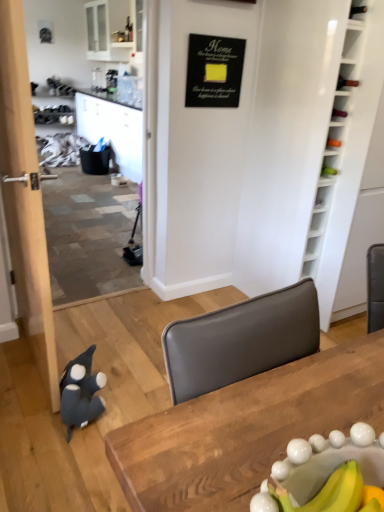
Question: Does point (112, 454) appear closer or farther from the camera than point (61, 413)?

Choices:
 (A) farther
 (B) closer

Answer: (B)

Question: From a real-world perspective, is wooden table at center positioned above or below dark gray plush penguin at lower left?

Choices:
 (A) above
 (B) below

Answer: (A)

Question: Which is farther from the white wood bookshelf at right?

Choices:
 (A) dark gray plush penguin at lower left
 (B) black matte signboard at upper center
 (C) wooden table at center

Answer: (C)

Question: Based on their relative distances, which object is farther from the black matte signboard at upper center?

Choices:
 (A) dark gray plush penguin at lower left
 (B) white wood bookshelf at right
 (C) wooden table at center

Answer: (C)